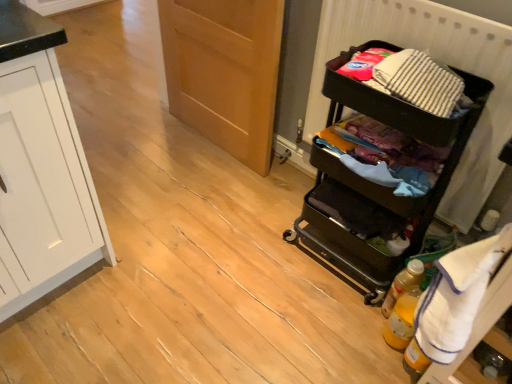
Image resolution: width=512 pixels, height=384 pixels. I want to click on free point in front of wooden door at center, so click(211, 188).